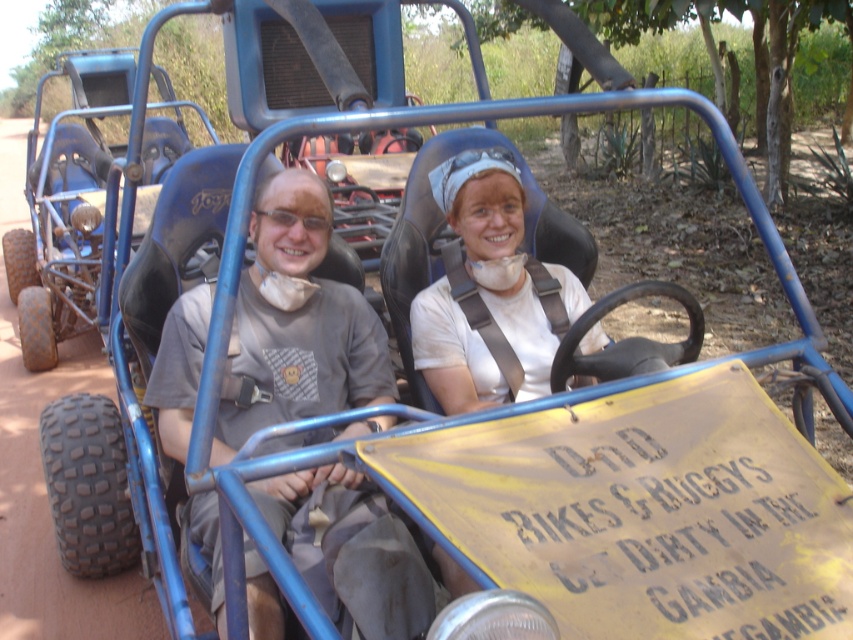
Looking at this image, can you confirm if white matte shirt at center is wider than blue matte go-kart at left?

Correct, the width of white matte shirt at center exceeds that of blue matte go-kart at left.

From the picture: Is white matte shirt at center to the right of blue matte go-kart at left from the viewer's perspective?

Indeed, white matte shirt at center is positioned on the right side of blue matte go-kart at left.

Which is in front, point (463, 202) or point (56, 298)?

Point (463, 202) is in front.

Locate an element on the screen. This screenshot has height=640, width=853. white matte shirt at center is located at coordinates (489, 292).

Which is below, matte gray t-shirt at center or white matte shirt at center?

matte gray t-shirt at center is below.

Measure the distance from matte gray t-shirt at center to white matte shirt at center.

17.10 inches

I want to click on matte gray t-shirt at center, so click(x=299, y=321).

Which is below, matte gray t-shirt at center or blue matte go-kart at left?

Positioned lower is matte gray t-shirt at center.

Is matte gray t-shirt at center above blue matte go-kart at left?

Actually, matte gray t-shirt at center is below blue matte go-kart at left.

Who is more forward, (296, 252) or (202, 113)?

Point (296, 252) is more forward.

Where is `matte gray t-shirt at center`? This screenshot has width=853, height=640. matte gray t-shirt at center is located at coordinates (299, 321).